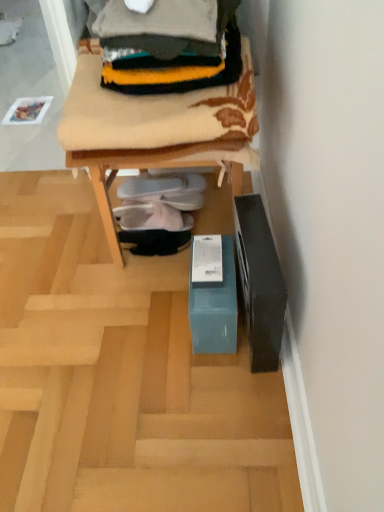
Image resolution: width=384 pixels, height=512 pixels. Find the location of `empty space that is ontop of teal cardboard box at lower center (from a real-world perspective)`. empty space that is ontop of teal cardboard box at lower center (from a real-world perspective) is located at coordinates (121, 317).